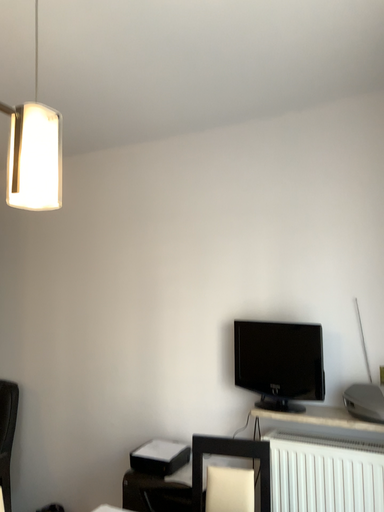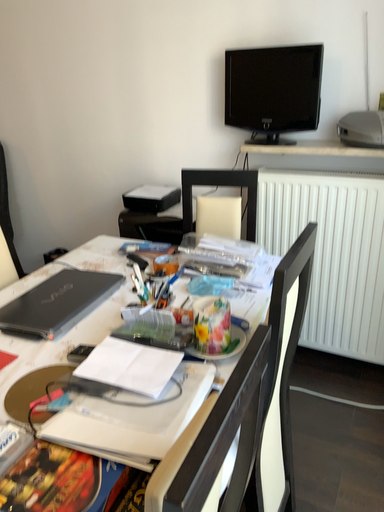
Question: Which way did the camera rotate in the video?

Choices:
 (A) rotated upward
 (B) rotated downward

Answer: (B)